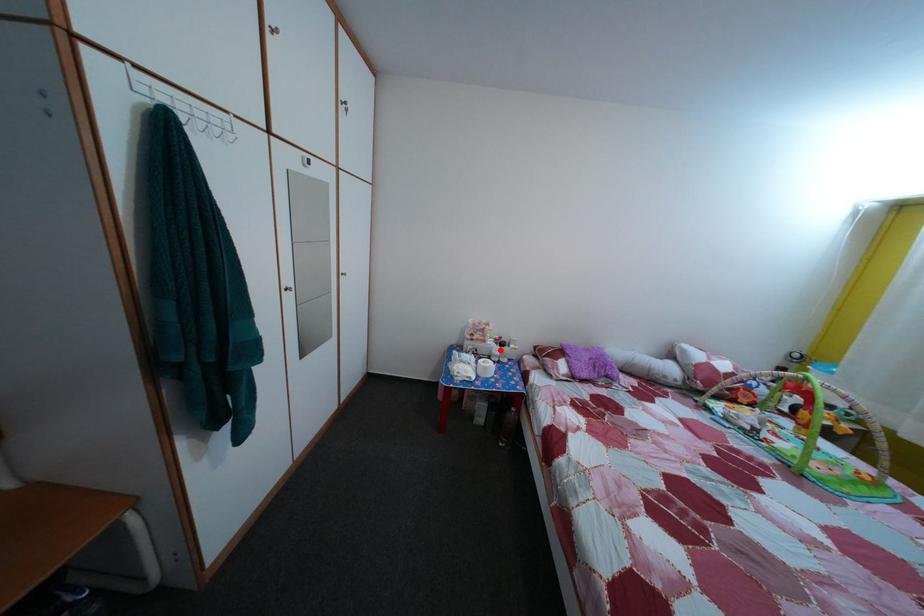
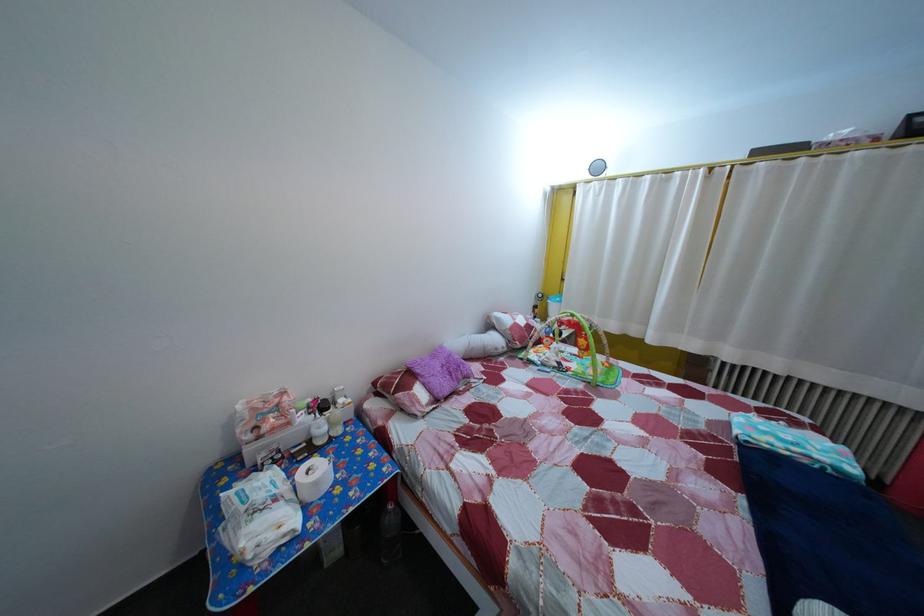
Question: I am providing you with two images of the same scene from different viewpoints. A red point is marked on the first image. At the location where the point appears in image 1, is it still visible in image 2?

Choices:
 (A) Yes
 (B) No

Answer: (A)